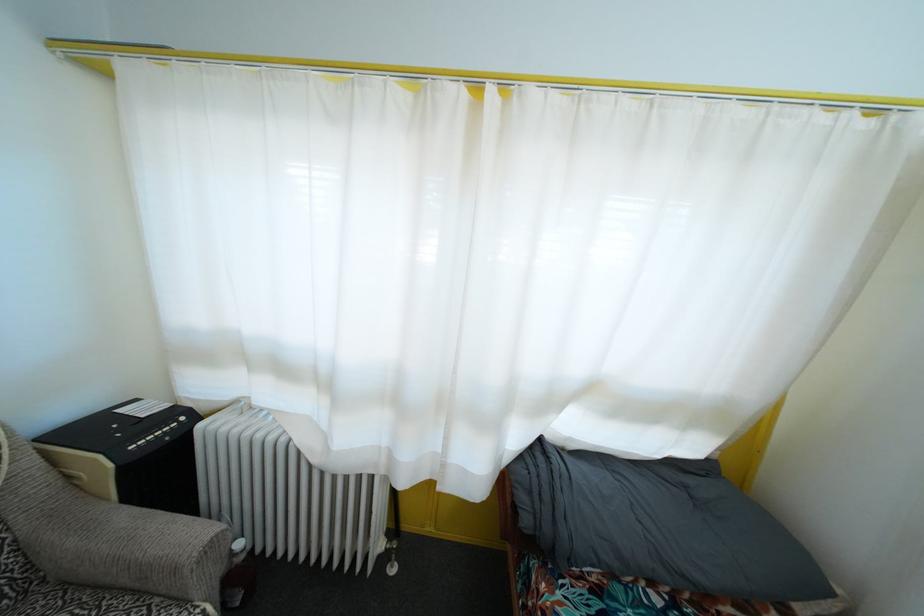
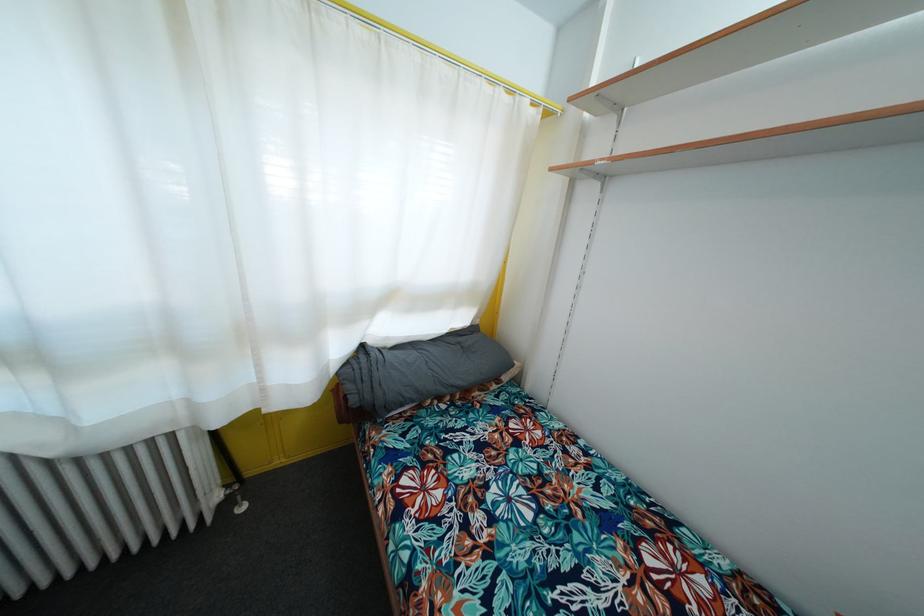
Find the pixel in the second image that matches point (394, 567) in the first image.

(240, 511)